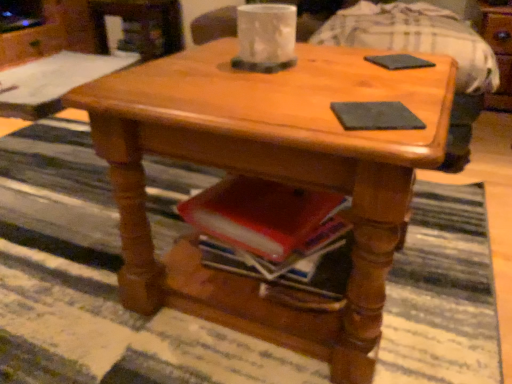
Question: Does black matte pad at center, marked as the 1th pad in a left-to-right arrangement, have a smaller size compared to black matte pad at upper right, placed as the 1th pad when sorted from top to bottom?

Choices:
 (A) no
 (B) yes

Answer: (B)

Question: Is the position of black matte pad at center, the 2th pad from the right, less distant than that of black matte pad at upper right, which appears as the 1th pad when viewed from the right?

Choices:
 (A) yes
 (B) no

Answer: (A)

Question: From the image's perspective, does black matte pad at center, marked as the 1th pad in a left-to-right arrangement, appear higher than black matte pad at upper right, arranged as the 2th pad when ordered from the bottom?

Choices:
 (A) yes
 (B) no

Answer: (B)

Question: Are black matte pad at center, the 2th pad from the right, and black matte pad at upper right, which appears as the 1th pad when viewed from the right, far apart?

Choices:
 (A) no
 (B) yes

Answer: (A)

Question: From a real-world perspective, is black matte pad at center, acting as the 1th pad starting from the bottom, on black matte pad at upper right, arranged as the 2th pad when ordered from the bottom?

Choices:
 (A) yes
 (B) no

Answer: (B)

Question: Is black matte pad at upper right, which appears as the 1th pad when viewed from the right, at the back of black matte pad at center, the 2th pad from the right?

Choices:
 (A) yes
 (B) no

Answer: (A)

Question: Considering the relative positions of black matte pad at upper right, placed as the second pad when sorted from left to right, and black matte pad at center, the 2th pad from the right, in the image provided, is black matte pad at upper right, placed as the second pad when sorted from left to right, to the right of black matte pad at center, the 2th pad from the right, from the viewer's perspective?

Choices:
 (A) yes
 (B) no

Answer: (A)

Question: Is black matte pad at upper right, which appears as the 1th pad when viewed from the right, located outside black matte pad at center, acting as the 2th pad starting from the back?

Choices:
 (A) no
 (B) yes

Answer: (B)

Question: Can you confirm if black matte pad at upper right, the 2th pad from the front, is smaller than black matte pad at center, acting as the 2th pad starting from the back?

Choices:
 (A) yes
 (B) no

Answer: (B)

Question: Considering the relative sizes of black matte pad at upper right, the 2th pad from the front, and black matte pad at center, the 2th pad from the right, in the image provided, is black matte pad at upper right, the 2th pad from the front, taller than black matte pad at center, the 2th pad from the right,?

Choices:
 (A) yes
 (B) no

Answer: (A)

Question: Does black matte pad at upper right, placed as the 1th pad when sorted from top to bottom, have a larger size compared to black matte pad at center, the 2th pad from the right?

Choices:
 (A) no
 (B) yes

Answer: (B)

Question: Does black matte pad at upper right, which appears as the 1th pad when viewed from the right, lie behind black matte pad at center, marked as the 1th pad in a left-to-right arrangement?

Choices:
 (A) no
 (B) yes

Answer: (B)

Question: Considering the relative sizes of shiny wood coffee table at center and black matte pad at center, which is the first pad from front to back, in the image provided, is shiny wood coffee table at center wider than black matte pad at center, which is the first pad from front to back,?

Choices:
 (A) yes
 (B) no

Answer: (A)